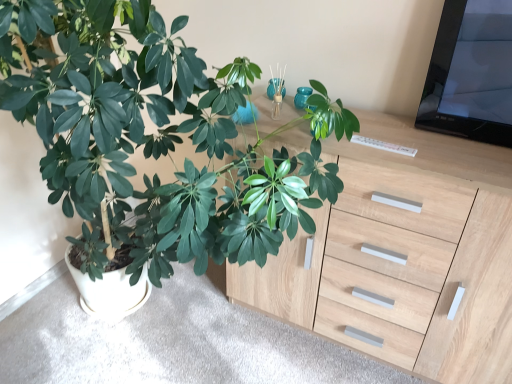
Question: Is matte wood cabinet at lower center to the left of light wood chest of drawers at center from the viewer's perspective?

Choices:
 (A) yes
 (B) no

Answer: (A)

Question: Does matte wood cabinet at lower center turn towards light wood chest of drawers at center?

Choices:
 (A) no
 (B) yes

Answer: (B)

Question: Can we say matte wood cabinet at lower center lies outside light wood chest of drawers at center?

Choices:
 (A) no
 (B) yes

Answer: (B)

Question: Would you say matte wood cabinet at lower center is a long distance from light wood chest of drawers at center?

Choices:
 (A) no
 (B) yes

Answer: (A)

Question: Does matte wood cabinet at lower center have a lesser width compared to light wood chest of drawers at center?

Choices:
 (A) yes
 (B) no

Answer: (B)

Question: From the image's perspective, is matte wood cabinet at lower center under light wood chest of drawers at center?

Choices:
 (A) no
 (B) yes

Answer: (B)

Question: Is matte wood cabinet at lower center positioned far away from green matte plant at left?

Choices:
 (A) no
 (B) yes

Answer: (A)

Question: Is matte wood cabinet at lower center at the left side of green matte plant at left?

Choices:
 (A) yes
 (B) no

Answer: (B)

Question: Does matte wood cabinet at lower center lie in front of green matte plant at left?

Choices:
 (A) no
 (B) yes

Answer: (A)

Question: Does matte wood cabinet at lower center have a greater height compared to green matte plant at left?

Choices:
 (A) yes
 (B) no

Answer: (B)

Question: From the image's perspective, is matte wood cabinet at lower center below green matte plant at left?

Choices:
 (A) no
 (B) yes

Answer: (B)

Question: Is the depth of matte wood cabinet at lower center greater than that of green matte plant at left?

Choices:
 (A) no
 (B) yes

Answer: (B)

Question: Considering the relative sizes of light wood chest of drawers at center and matte wood cabinet at lower center in the image provided, is light wood chest of drawers at center wider than matte wood cabinet at lower center?

Choices:
 (A) yes
 (B) no

Answer: (B)